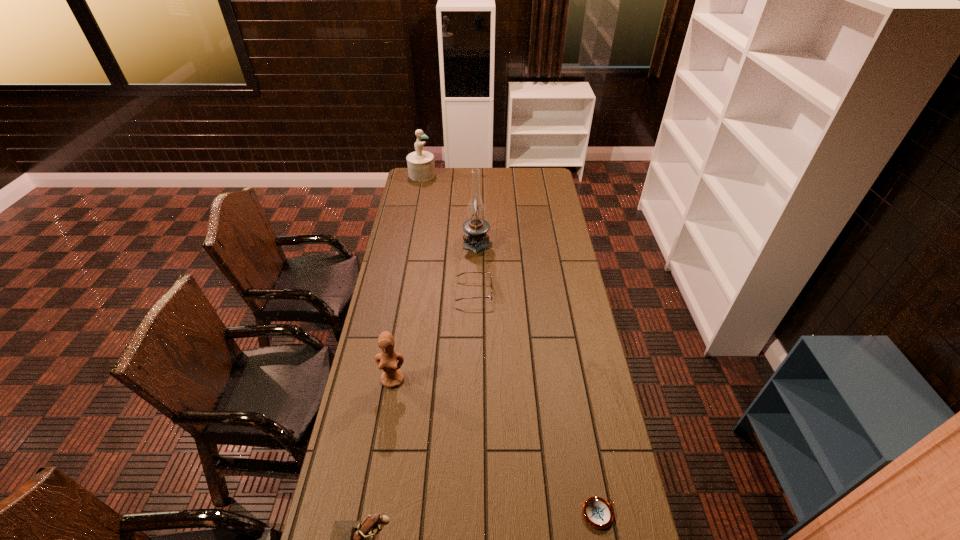
Where is `the closest figurine relative to the farthest object`? the closest figurine relative to the farthest object is located at coordinates (392, 376).

What are the coordinates of `free space that satisfies the following two spatial constraints: 1. on the front-facing side of the fourth nearest object; 2. on the left side of the rightmost object` in the screenshot? It's located at (471, 514).

You are a GUI agent. You are given a task and a screenshot of the screen. Output one action in this format:
    pyautogui.click(x=<x>, y=<y>)
    Task: Click on the vacant region that satisfies the following two spatial constraints: 1. on the front-facing side of the spectacles; 2. on the left side of the shortest object
    The height and width of the screenshot is (540, 960).
    Given the screenshot: What is the action you would take?
    pyautogui.click(x=471, y=514)

What are the coordinates of `free space in the image that satisfies the following two spatial constraints: 1. on the front-facing side of the second shortest object; 2. on the left side of the shortest object` in the screenshot? It's located at (471, 514).

Locate an element on the screen. free space in the image that satisfies the following two spatial constraints: 1. on the back side of the second farthest object; 2. at the beak of the tallest figurine is located at coordinates (477, 174).

Locate an element on the screen. Image resolution: width=960 pixels, height=540 pixels. vacant space that satisfies the following two spatial constraints: 1. on the back side of the shortest object; 2. on the front-facing side of the spectacles is located at coordinates (559, 292).

Where is `vacant space that satisfies the following two spatial constraints: 1. on the front-facing side of the rightmost object; 2. on the right side of the fourth farthest object`? vacant space that satisfies the following two spatial constraints: 1. on the front-facing side of the rightmost object; 2. on the right side of the fourth farthest object is located at coordinates (371, 514).

Where is `free space in the image that satisfies the following two spatial constraints: 1. at the beak of the oil lamp; 2. on the left side of the tallest figurine`? free space in the image that satisfies the following two spatial constraints: 1. at the beak of the oil lamp; 2. on the left side of the tallest figurine is located at coordinates point(409,241).